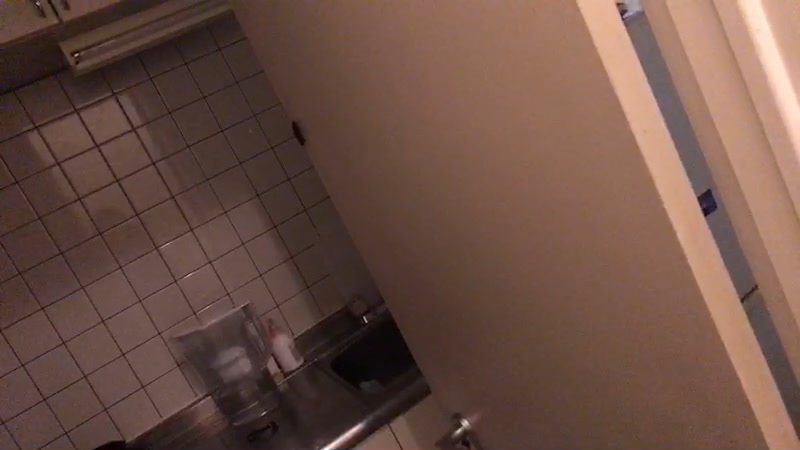
Locate an element on the screen. The image size is (800, 450). sink basin is located at coordinates (364, 361).